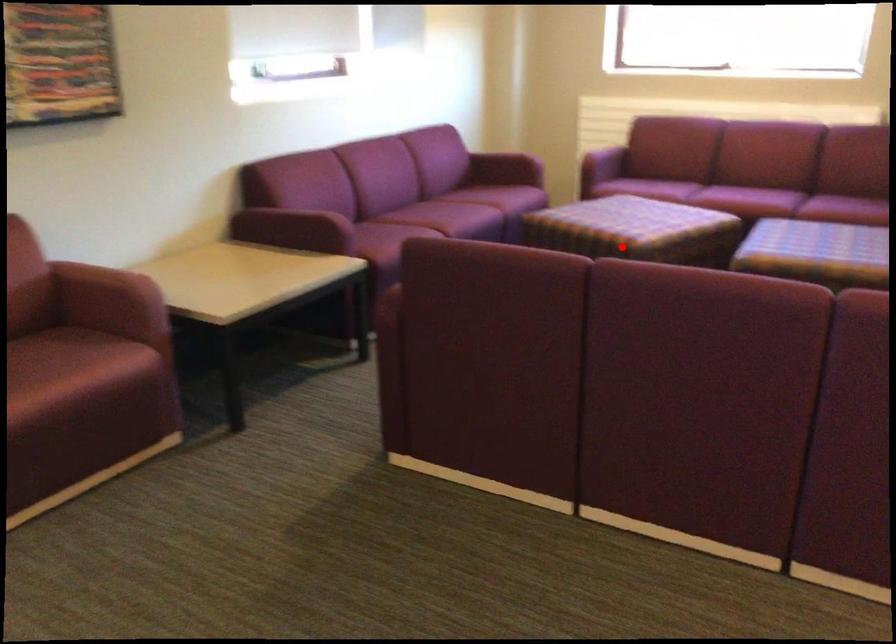
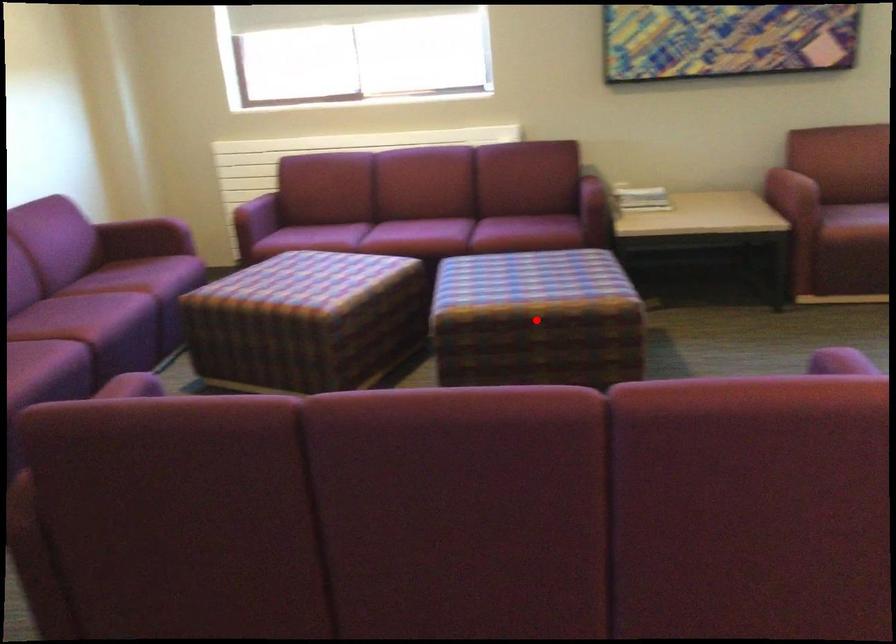
I am providing you with two images of the same scene from different viewpoints. A red point is marked on the first image and another point is marked on the second image. Are the points marked in image1 and image2 representing the same 3D position?

No